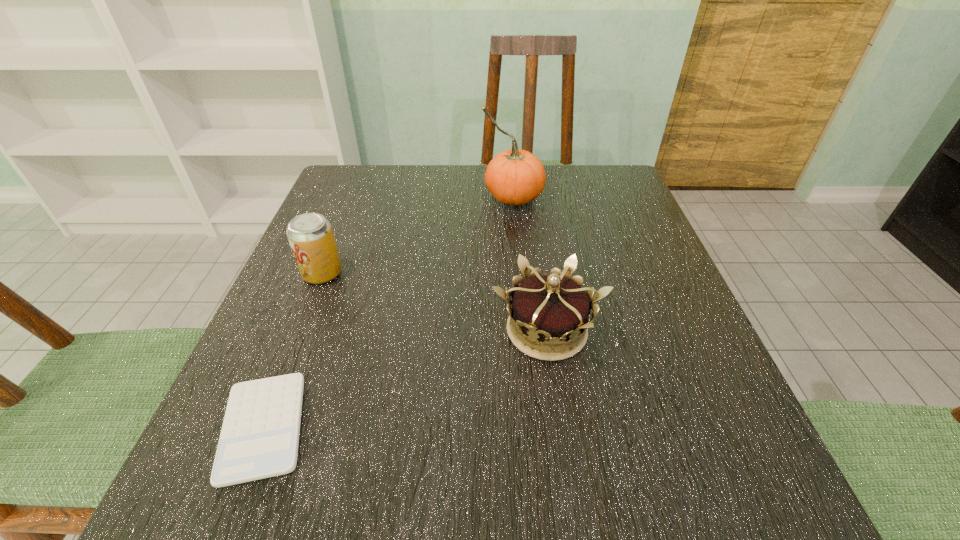
This screenshot has width=960, height=540. What are the coordinates of `the tallest object` in the screenshot? It's located at (515, 177).

Locate an element on the screen. Image resolution: width=960 pixels, height=540 pixels. pumpkin is located at coordinates (515, 177).

Identify the location of crown. [x=552, y=308].

This screenshot has width=960, height=540. I want to click on the third nearest object, so click(x=310, y=235).

At what (x,y) coordinates should I click in order to perform the action: click on the nearest object. Please return your answer as a coordinate pair (x, y). Looking at the image, I should click on (259, 439).

Identify the location of calculator. The height and width of the screenshot is (540, 960). (259, 439).

This screenshot has width=960, height=540. Identify the location of vacant region located on the left of the pumpkin. (394, 197).

What are the coordinates of `vacant space located 0.050m on the front of the third farthest object` in the screenshot? It's located at (557, 399).

Find the location of a particular element. free region located 0.360m on the right of the pop (soda) is located at coordinates (529, 273).

This screenshot has width=960, height=540. In order to click on vacant area located on the right of the calculator in this screenshot , I will do `click(368, 427)`.